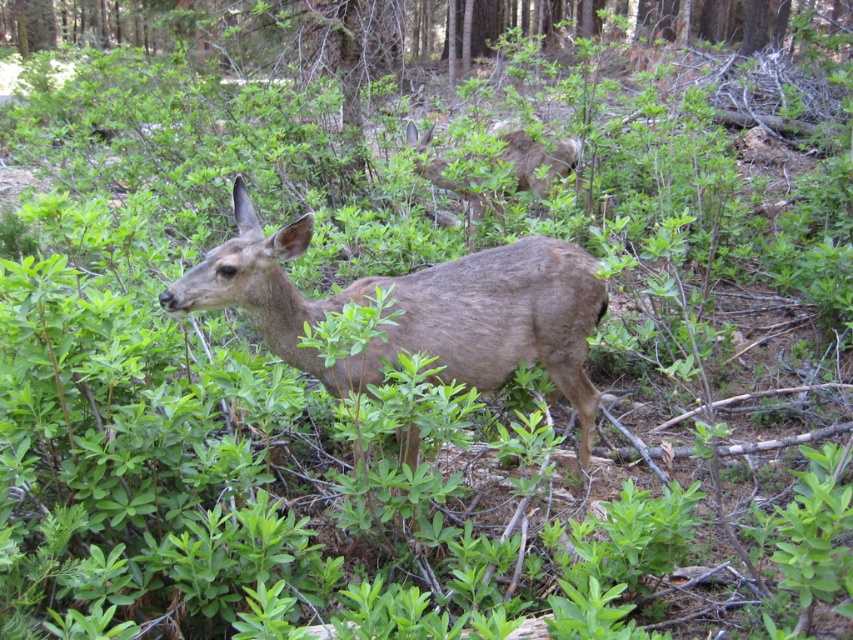
Measure the distance between brown fur deer at center and brown furry deer at upper center.

brown fur deer at center and brown furry deer at upper center are 2.59 meters apart.

The image size is (853, 640). In order to click on brown fur deer at center in this screenshot , I will do `click(418, 308)`.

Identify the location of brown fur deer at center. This screenshot has width=853, height=640. (418, 308).